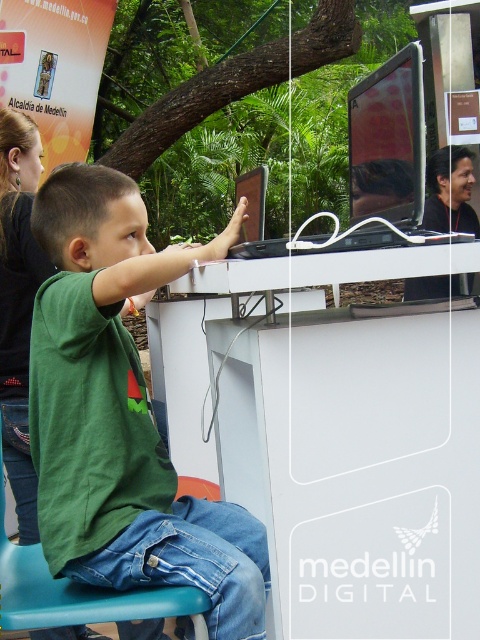
Between green matte shirt at center and matte black monitor at center, which one appears on the right side from the viewer's perspective?

From the viewer's perspective, matte black monitor at center appears more on the right side.

Measure the distance between point (157,452) and camera.

Point (157,452) is 1.39 meters from camera.

Is point (173, 576) farther from viewer compared to point (386, 90)?

No, (173, 576) is in front of (386, 90).

Locate an element on the screen. This screenshot has width=480, height=640. green matte shirt at center is located at coordinates (121, 413).

This screenshot has height=640, width=480. What do you see at coordinates (121, 413) in the screenshot?
I see `green matte shirt at center` at bounding box center [121, 413].

Is point (81, 474) farther from camera compared to point (204, 621)?

Yes, it is.

Who is more forward, (101, 432) or (43, 608)?

Point (43, 608)

Locate an element on the screen. green matte shirt at center is located at coordinates (121, 413).

Which of these two, matte black monitor at center or blue plastic chair at lower left, stands shorter?

blue plastic chair at lower left is shorter.

Between matte black monitor at center and blue plastic chair at lower left, which one appears on the right side from the viewer's perspective?

matte black monitor at center

Is point (373, 88) positioned behind point (58, 618)?

That is True.

The image size is (480, 640). I want to click on matte black monitor at center, so click(x=375, y=168).